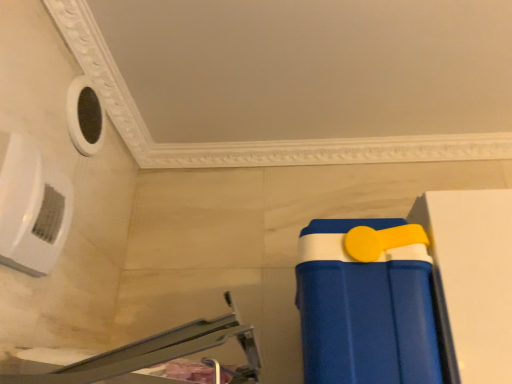
Question: Can you confirm if blue plastic cooler at lower right is bigger than blue plastic tray at lower right?

Choices:
 (A) no
 (B) yes

Answer: (A)

Question: Is the position of blue plastic cooler at lower right less distant than that of blue plastic tray at lower right?

Choices:
 (A) no
 (B) yes

Answer: (A)

Question: Is the depth of blue plastic cooler at lower right greater than that of blue plastic tray at lower right?

Choices:
 (A) yes
 (B) no

Answer: (A)

Question: Is blue plastic cooler at lower right oriented away from blue plastic tray at lower right?

Choices:
 (A) no
 (B) yes

Answer: (A)

Question: Can you confirm if blue plastic cooler at lower right is positioned to the right of blue plastic tray at lower right?

Choices:
 (A) no
 (B) yes

Answer: (B)

Question: Would you consider blue plastic cooler at lower right to be distant from blue plastic tray at lower right?

Choices:
 (A) yes
 (B) no

Answer: (B)

Question: From the image's perspective, is blue plastic tray at lower right located beneath blue plastic cooler at lower right?

Choices:
 (A) yes
 (B) no

Answer: (B)

Question: Is blue plastic tray at lower right aimed at blue plastic cooler at lower right?

Choices:
 (A) no
 (B) yes

Answer: (A)

Question: Is blue plastic tray at lower right behind blue plastic cooler at lower right?

Choices:
 (A) no
 (B) yes

Answer: (A)

Question: Does blue plastic tray at lower right appear on the left side of blue plastic cooler at lower right?

Choices:
 (A) yes
 (B) no

Answer: (A)

Question: Considering the relative sizes of blue plastic tray at lower right and blue plastic cooler at lower right in the image provided, is blue plastic tray at lower right shorter than blue plastic cooler at lower right?

Choices:
 (A) yes
 (B) no

Answer: (A)

Question: Is blue plastic tray at lower right looking in the opposite direction of blue plastic cooler at lower right?

Choices:
 (A) yes
 (B) no

Answer: (B)

Question: Is blue plastic tray at lower right to the left or to the right of blue plastic cooler at lower right in the image?

Choices:
 (A) left
 (B) right

Answer: (A)